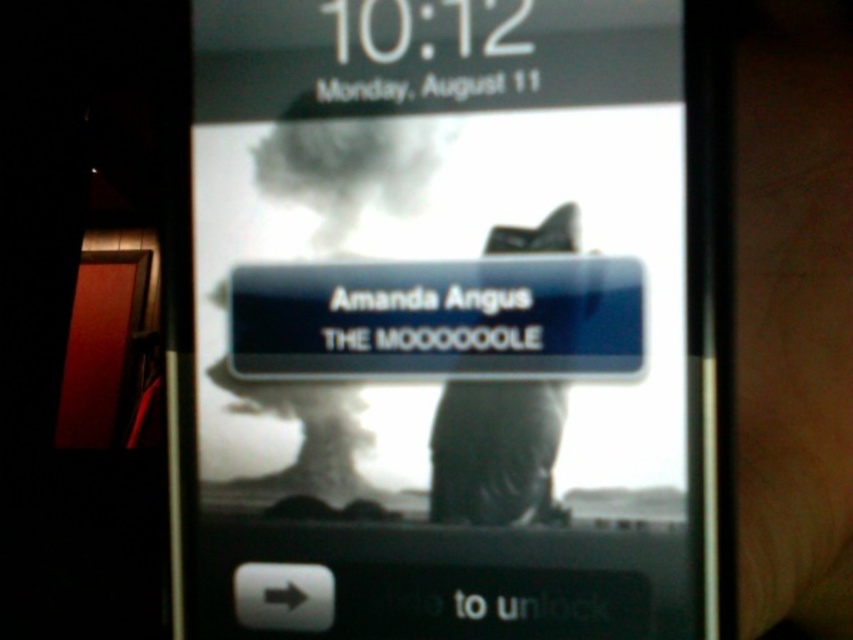
Can you confirm if brown leather hand at right is shorter than dark matte jacket at center?

No, brown leather hand at right is not shorter than dark matte jacket at center.

Is brown leather hand at right positioned in front of dark matte jacket at center?

Yes, it is in front of dark matte jacket at center.

What do you see at coordinates (793, 316) in the screenshot? I see `brown leather hand at right` at bounding box center [793, 316].

You are a GUI agent. You are given a task and a screenshot of the screen. Output one action in this format:
    pyautogui.click(x=<x>, y=<y>)
    Task: Click on the brown leather hand at right
    
    Given the screenshot: What is the action you would take?
    pyautogui.click(x=793, y=316)

Does point (366, 624) lie in front of point (747, 576)?

Yes, point (366, 624) is closer to viewer.

I want to click on matte black phone at center, so click(445, 323).

Is point (320, 560) farther from viewer compared to point (811, 499)?

No, (320, 560) is in front of (811, 499).

I want to click on matte black phone at center, so click(445, 323).

Can you confirm if matte black phone at center is positioned above dark matte jacket at center?

Yes, matte black phone at center is above dark matte jacket at center.

Is the position of matte black phone at center more distant than that of dark matte jacket at center?

No.

Identify the location of matte black phone at center. This screenshot has width=853, height=640. (445, 323).